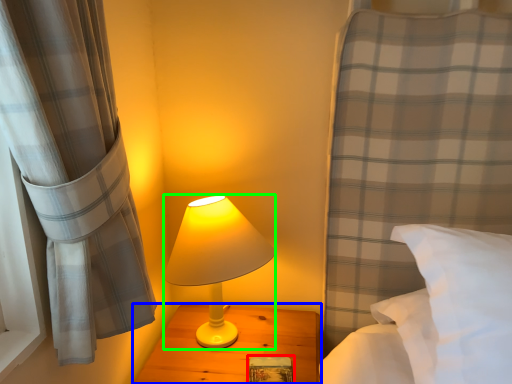
Question: Considering the real-world distances, which object is farthest from book (highlighted by a red box)? nightstand (highlighted by a blue box) or lamp (highlighted by a green box)?

Choices:
 (A) nightstand
 (B) lamp

Answer: (B)